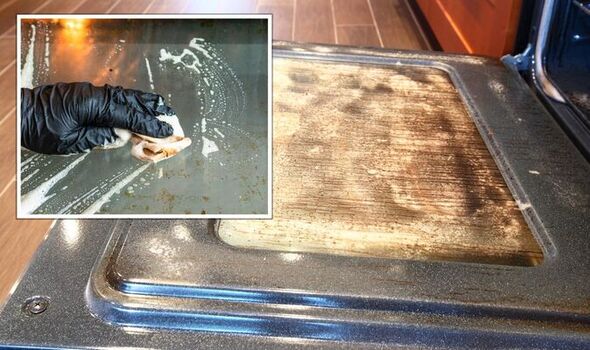
Find the location of a particular element. picture corners is located at coordinates (267, 16), (18, 16), (17, 217), (272, 217).